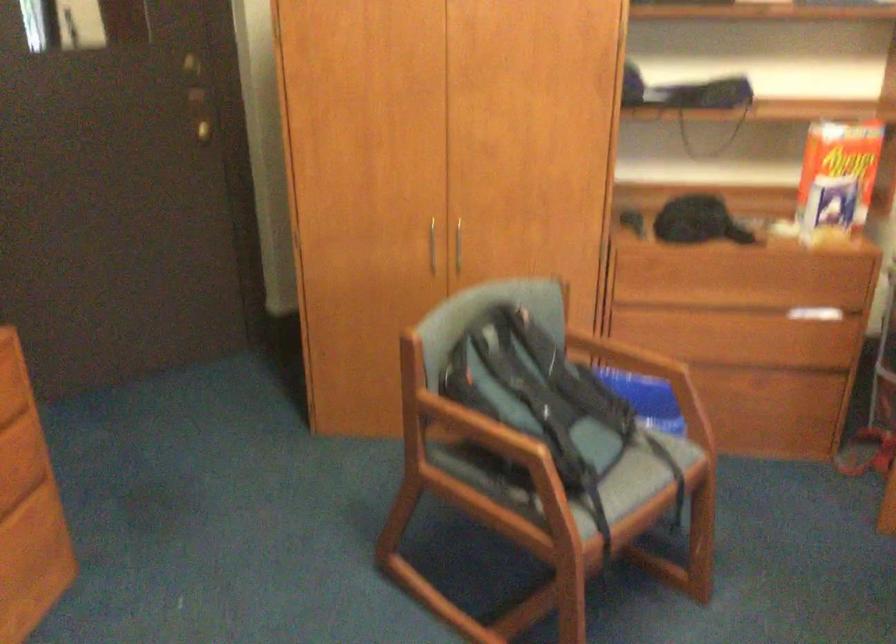
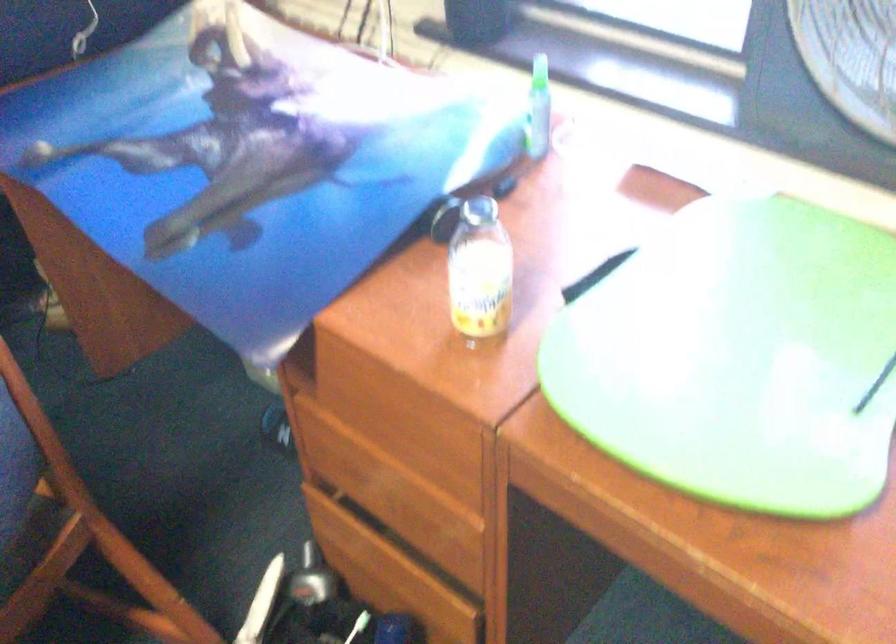
Based on the continuous images, in which direction is the camera rotating?

The camera rotated toward right-down.